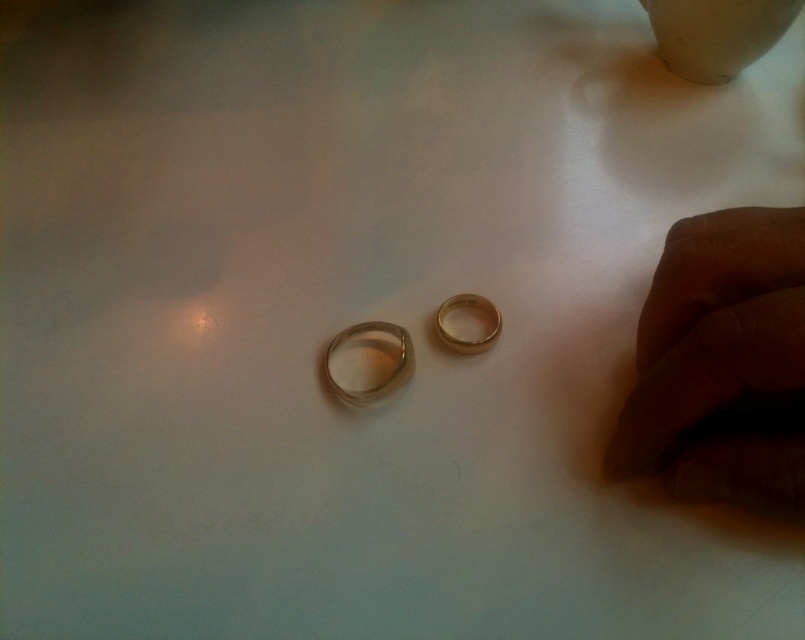
You are arranging two gold rings on a table. The matte gold ring at center and the polished gold ring at center. Which one is positioned to the right side?

The matte gold ring at center is positioned to the right of the polished gold ring at center.

You are looking at two points on a table. The first point is at position point (x=362, y=400) and the second point is at position point (x=452, y=348). Which point is closer to you?

Point (x=362, y=400) is in front of point (x=452, y=348), so it is closer to you.

Looking at this image, you are looking at two points on a table. The first point is at coordinates point (762, 305) and the second is at point (461, 346). Which point is closer to you?

Point (762, 305) is closer to the camera than point (461, 346).